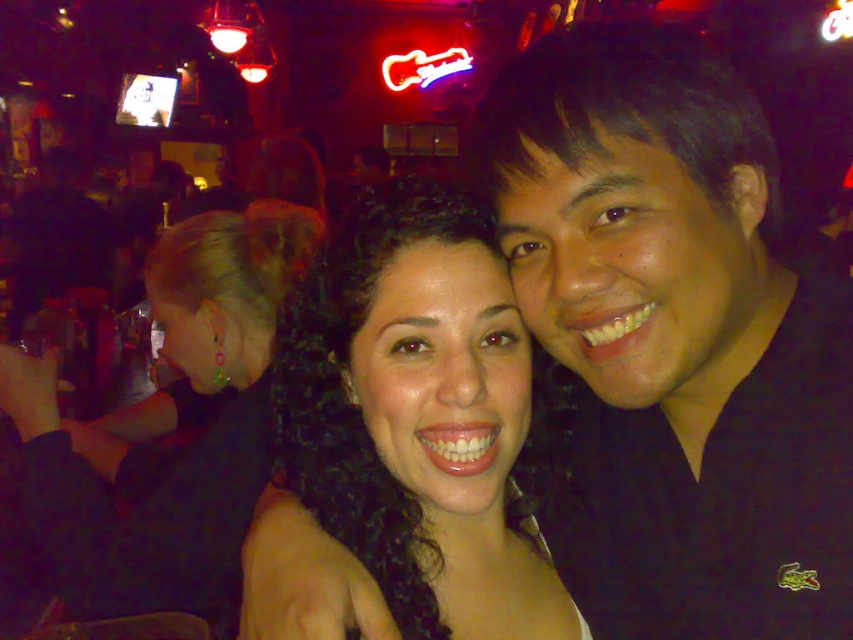
Question: Which is farther from the matte black hair at center?

Choices:
 (A) black matte shirt at center
 (B) satin black dress at upper left

Answer: (B)

Question: From the image, what is the correct spatial relationship of black matte shirt at center in relation to matte black hair at center?

Choices:
 (A) right
 (B) left

Answer: (A)

Question: Is matte black hair at center to the left of satin black dress at upper left from the viewer's perspective?

Choices:
 (A) yes
 (B) no

Answer: (B)

Question: Which object is positioned closest to the black matte shirt at center?

Choices:
 (A) satin black dress at upper left
 (B) matte black hair at center

Answer: (B)

Question: Is black matte shirt at center further to the viewer compared to matte black hair at center?

Choices:
 (A) no
 (B) yes

Answer: (A)

Question: Which point is closer to the camera?

Choices:
 (A) black matte shirt at center
 (B) matte black hair at center
 (C) satin black dress at upper left

Answer: (A)